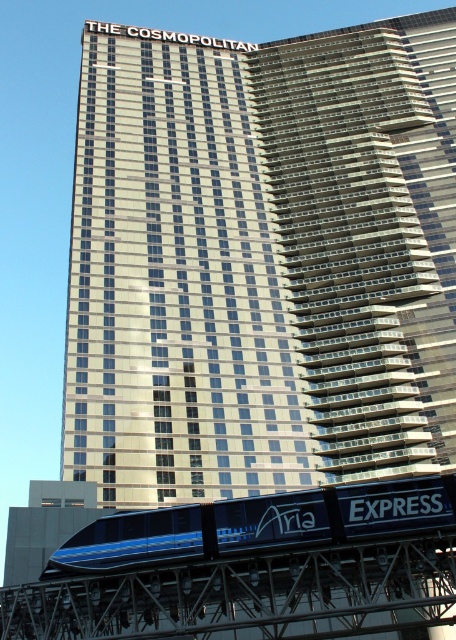
You are a city planner evaluating the urban layout. Considering the height difference between the glassy silver skyscraper at center and the blue glossy monorail at lower center, which one would cast a longer shadow at noon on a clear day?

The glassy silver skyscraper at center is much taller than the blue glossy monorail at lower center, so it would cast a longer shadow at noon on a clear day.

You are standing on the rooftop of the glassy silver skyscraper at center and want to see the blue glossy monorail at lower center. In which direction should you look to see it?

The blue glossy monorail at lower center is positioned below the glassy silver skyscraper at center, so you should look downward to see it.

You are a city planner evaluating the urban layout. Given the glassy silver skyscraper at center and the blue glossy monorail at lower center, which object would require more space for maintenance access considering their sizes?

The glassy silver skyscraper at center is larger in size than the blue glossy monorail at lower center, so it would require more space for maintenance access.